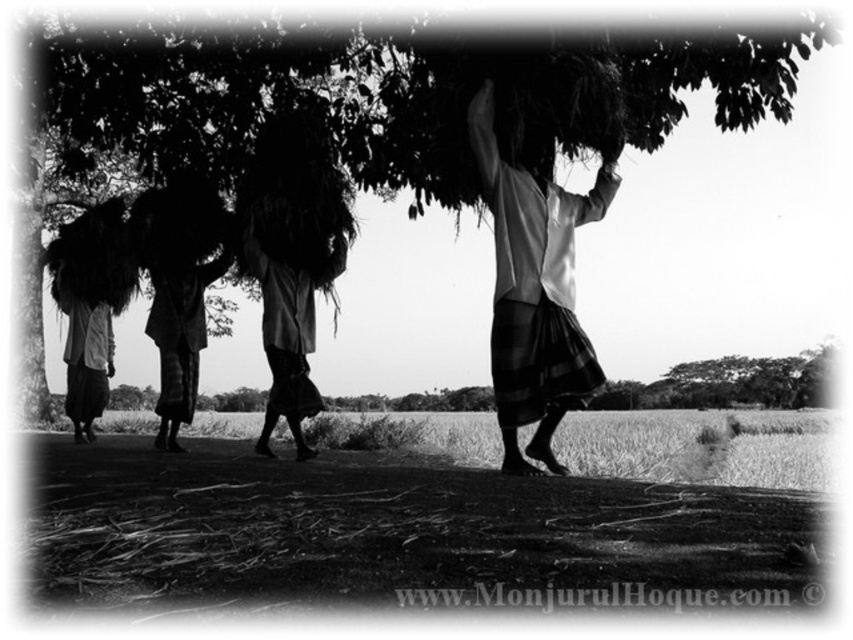
You are a farmer in the scene and need to choose between the white fabric basket at center and the dark fabric bundle at center to carry more crops. Which one should you choose?

The dark fabric bundle at center is larger than the white fabric basket at center, so you should choose the dark fabric bundle at center to carry more crops.

Looking at the rural scene, you notice a white fabric basket at center and a dark fabric bundle at center. Which one is positioned more to the right side?

The white fabric basket at center is positioned more to the right side than the dark fabric bundle at center.

You are a traveler standing in the middle of the field looking at the green leafy tree at upper center and the dark fabric bundle at center. Which object appears taller in the scene?

The green leafy tree at upper center appears taller than the dark fabric bundle at center.